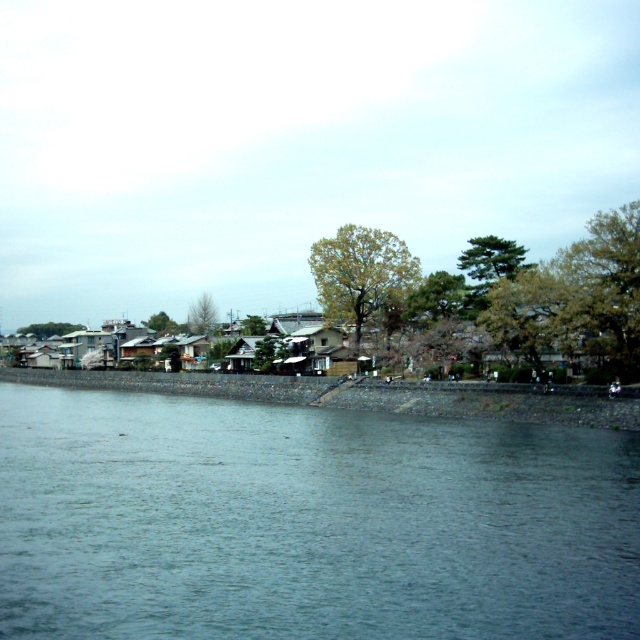
Who is lower down, blue water at center or smooth concrete shoreline at lower center?

Result: smooth concrete shoreline at lower center is below.

Does point (282, 582) come farther from viewer compared to point (115, 388)?

No.

Find the location of a particular element. The width and height of the screenshot is (640, 640). blue water at center is located at coordinates point(307,522).